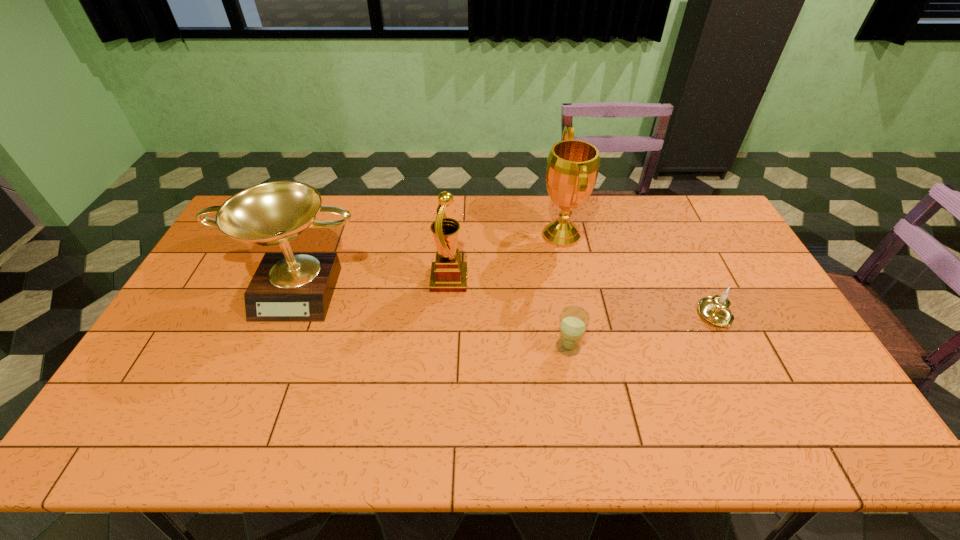
The width and height of the screenshot is (960, 540). Find the location of `free space located on the left of the glass`. free space located on the left of the glass is located at coordinates (429, 347).

The image size is (960, 540). In order to click on free space located 0.150m on the handle side of the rightmost object in this screenshot , I will do `click(748, 381)`.

I want to click on object that is at the far edge, so click(x=572, y=169).

What are the coordinates of `object present at the left edge` in the screenshot? It's located at (287, 287).

Locate an element on the screen. object that is at the right edge is located at coordinates (715, 310).

Locate an element on the screen. free space at the far edge of the desktop is located at coordinates 336,230.

Where is `blank area at the near edge`? The width and height of the screenshot is (960, 540). blank area at the near edge is located at coordinates (193, 442).

In the image, there is a desktop. Identify the location of free space at the left edge. The height and width of the screenshot is (540, 960). (180, 351).

The width and height of the screenshot is (960, 540). In the image, there is a desktop. Identify the location of free space at the right edge. (742, 338).

Locate an element on the screen. free space between the glass and the leftmost award is located at coordinates (435, 317).